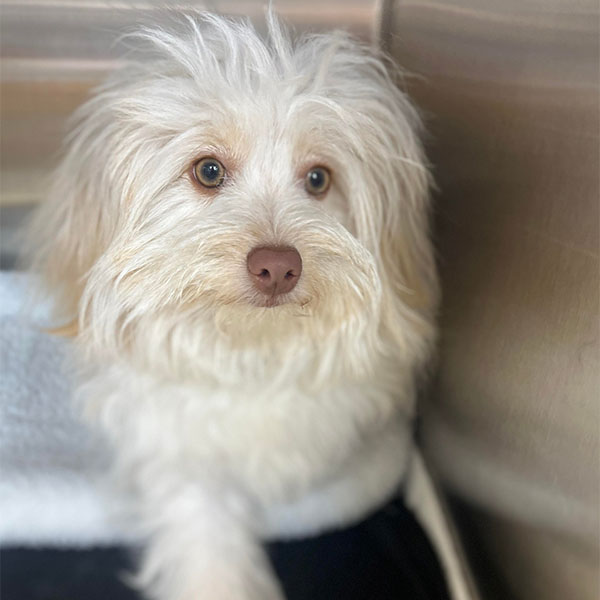
At what (x,y) coordinates should I click in order to perform the action: click on walls. Please return your answer as a coordinate pair (x, y). The width and height of the screenshot is (600, 600). Looking at the image, I should click on (64, 23), (525, 195).